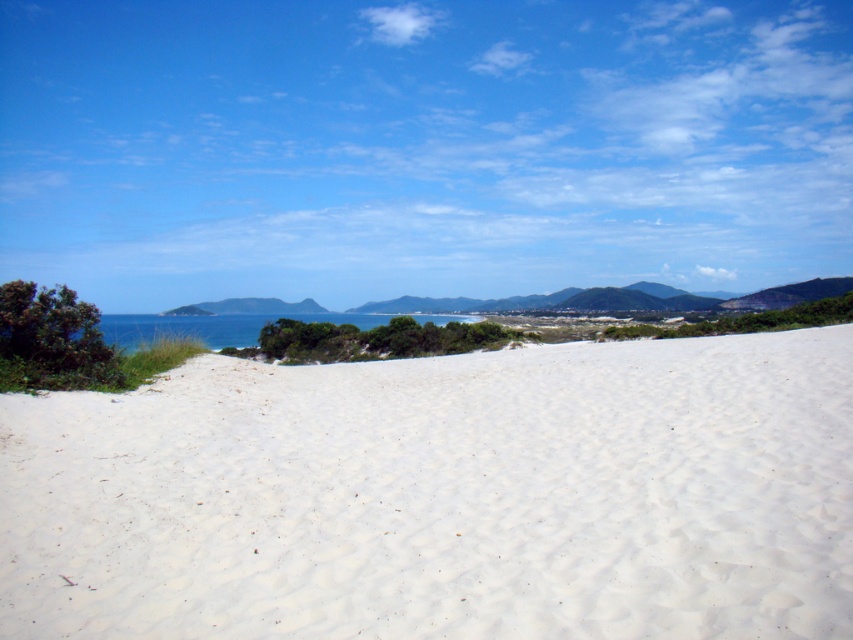
Which is above, white sandy beach at center or blue water at center?

Positioned higher is blue water at center.

Describe the element at coordinates (442, 497) in the screenshot. I see `white sandy beach at center` at that location.

The height and width of the screenshot is (640, 853). Identify the location of white sandy beach at center. (442, 497).

At what (x,y) coordinates should I click in order to perform the action: click on white sandy beach at center. Please return your answer as a coordinate pair (x, y). Looking at the image, I should click on [442, 497].